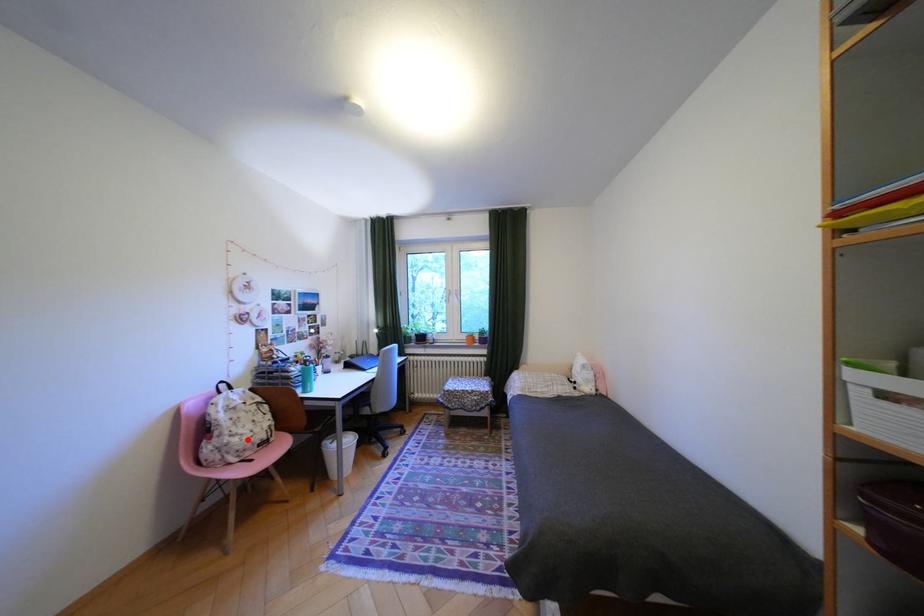
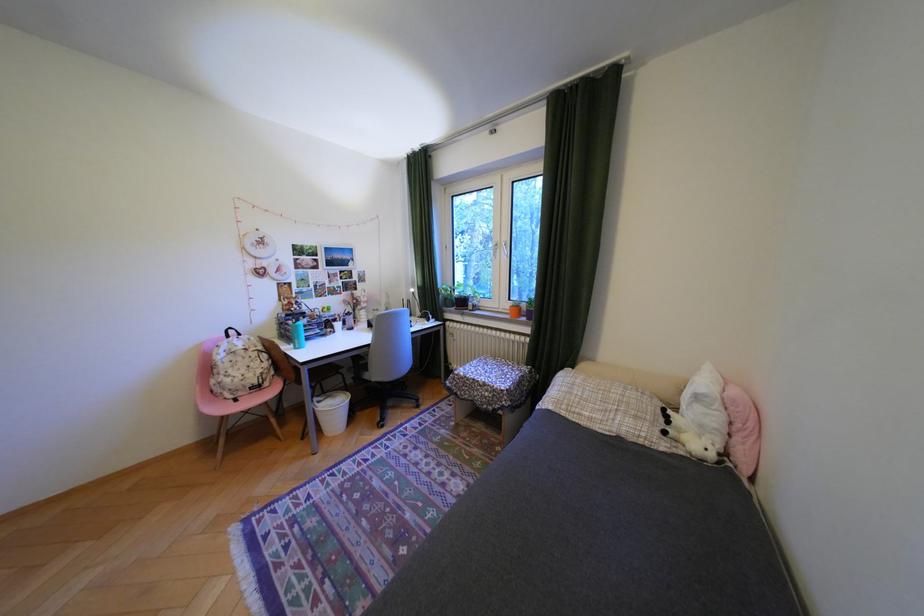
In the second image, find the point that corresponds to the highlighted location in the first image.

(239, 379)